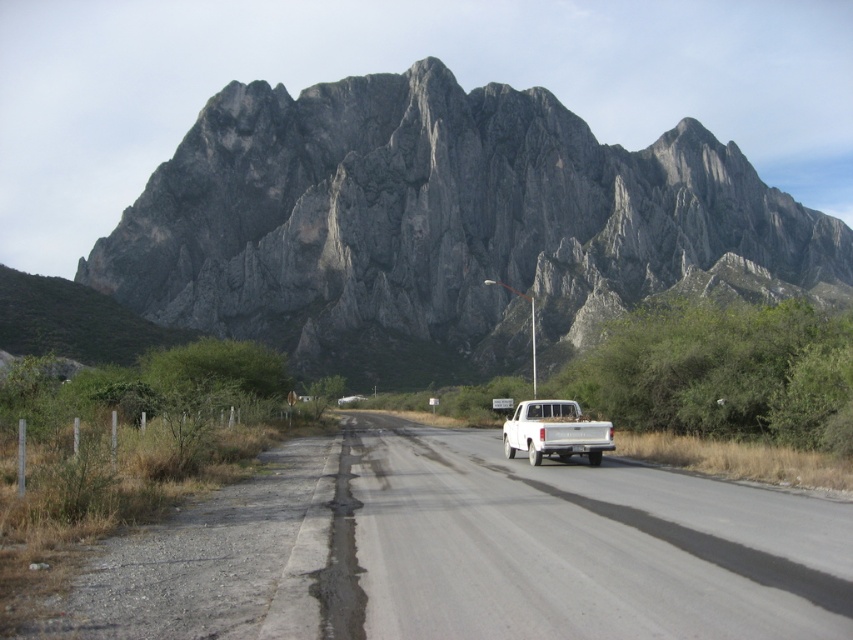
You are navigating a drone that needs to capture a photo of the gray rock mountain at upper center. According to the scene description, where exactly should the drone focus its camera to ensure the mountain is centered in the photo?

The gray rock mountain at upper center is located at point (444, 227), so the drone should focus its camera at coordinates 0.355 on the x axis and 0.521 on the y axis to center the mountain in the photo.

You are a driver approaching the intersection where the white smooth asphalt road at center and the gravelly asphalt road at lower left meet. Which road should you take if you want to continue driving straight ahead?

You should take the white smooth asphalt road at center because it is positioned to the right of the gravelly asphalt road at lower left, indicating it continues straight while the other may turn off.